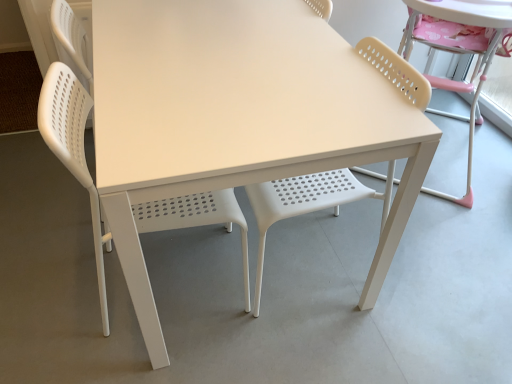
What are the coordinates of `vacant location below matte white chair at center, which ranks as the 2th chair in left-to-right order (from a real-world perspective)` in the screenshot? It's located at (306, 260).